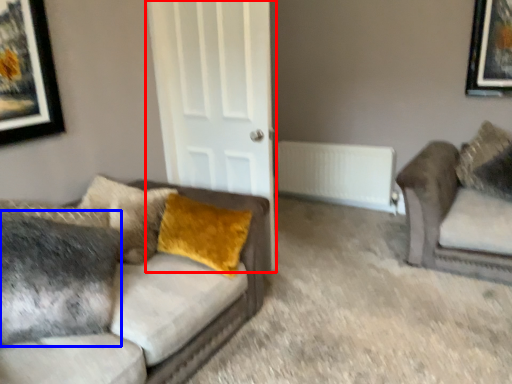
Question: Which object appears closest to the camera in this image, door (highlighted by a red box) or pillow (highlighted by a blue box)?

Choices:
 (A) door
 (B) pillow

Answer: (B)